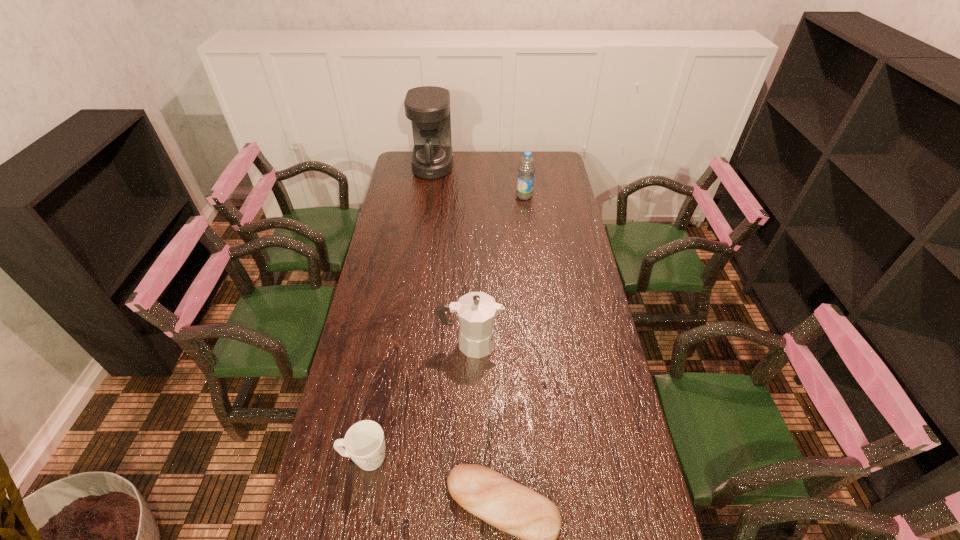
Where is `the tallest object`? the tallest object is located at coordinates (428, 107).

Identify the location of coffee maker. (428, 107).

The width and height of the screenshot is (960, 540). In order to click on water bottle in this screenshot , I will do `click(526, 168)`.

This screenshot has width=960, height=540. In order to click on the third nearest object in this screenshot , I will do pos(476,311).

This screenshot has height=540, width=960. I want to click on mug, so click(364, 442).

Where is `vacant space located 0.270m on the button side of the farthest object`? Image resolution: width=960 pixels, height=540 pixels. vacant space located 0.270m on the button side of the farthest object is located at coordinates (506, 166).

Identify the location of free location located on the left of the second farthest object. (473, 196).

Where is `free space located at the spout of the coffeepot`? free space located at the spout of the coffeepot is located at coordinates (551, 343).

Find the location of a particular element. The width and height of the screenshot is (960, 540). vacant space located 0.240m on the side of the fourth tallest object with the handle is located at coordinates (478, 458).

This screenshot has width=960, height=540. Find the location of `object located in the far edge section of the desktop`. object located in the far edge section of the desktop is located at coordinates (428, 107).